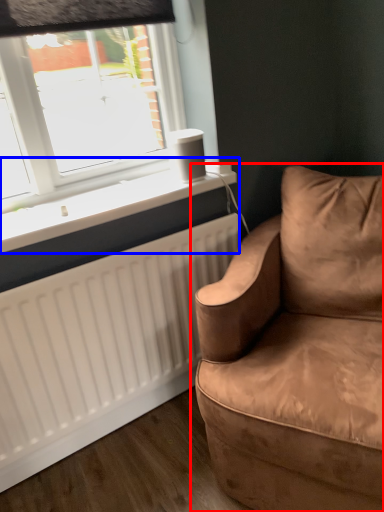
Question: Which object is closer to the camera taking this photo, studio couch (highlighted by a red box) or window sill (highlighted by a blue box)?

Choices:
 (A) studio couch
 (B) window sill

Answer: (A)